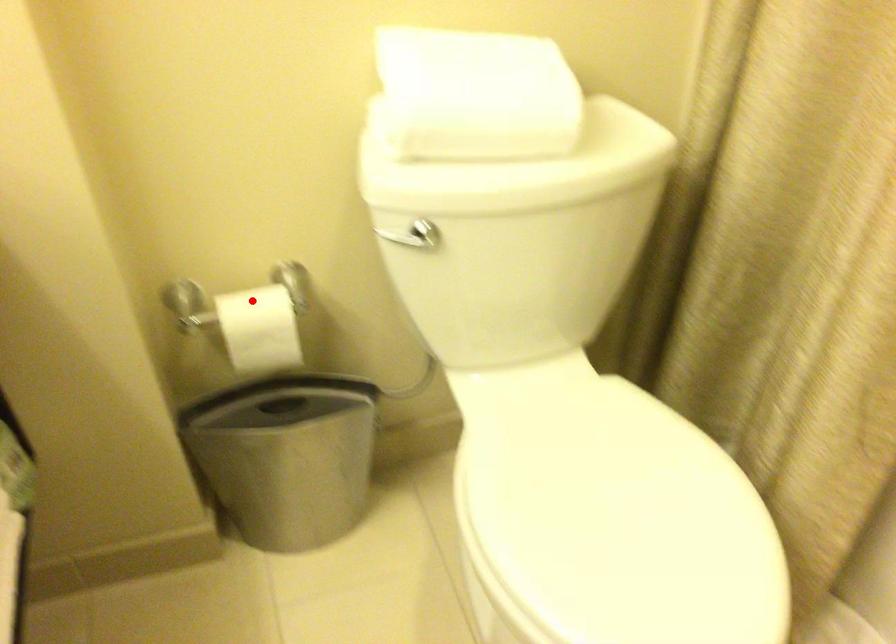
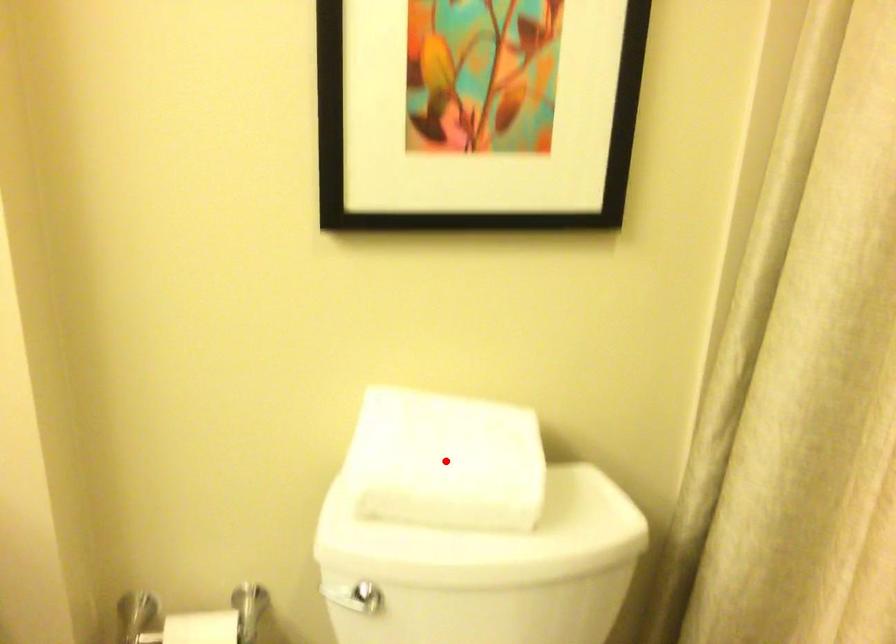
I am providing you with two images of the same scene from different viewpoints. A red point is marked on the first image and another point is marked on the second image. Do the highlighted points in image1 and image2 indicate the same real-world spot?

No